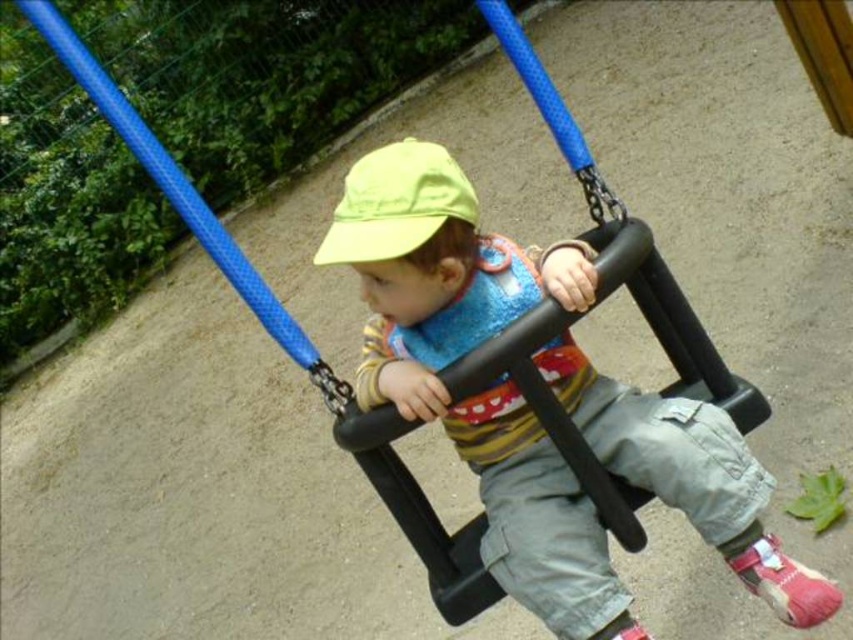
Who is positioned more to the right, matte black swing seat at center or yellow fabric hat at center?

matte black swing seat at center

Is point (467, 435) closer to viewer compared to point (421, 228)?

No, it is not.

Locate an element on the screen. The image size is (853, 640). matte black swing seat at center is located at coordinates (486, 387).